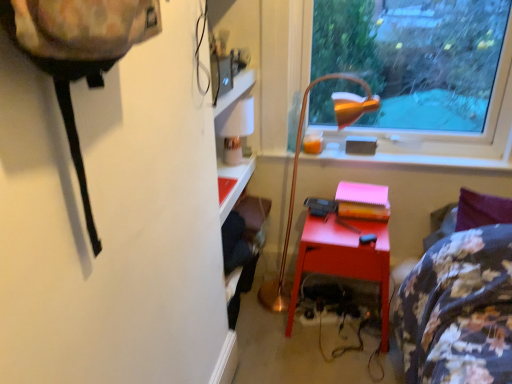
Question: Considering the relative sizes of transparent glass window at upper right and gold metallic floor lamp at center in the image provided, is transparent glass window at upper right wider than gold metallic floor lamp at center?

Choices:
 (A) yes
 (B) no

Answer: (B)

Question: Does transparent glass window at upper right lie in front of gold metallic floor lamp at center?

Choices:
 (A) yes
 (B) no

Answer: (B)

Question: Is transparent glass window at upper right further to the viewer compared to gold metallic floor lamp at center?

Choices:
 (A) yes
 (B) no

Answer: (A)

Question: Is transparent glass window at upper right to the right of gold metallic floor lamp at center from the viewer's perspective?

Choices:
 (A) yes
 (B) no

Answer: (A)

Question: Is transparent glass window at upper right placed right next to gold metallic floor lamp at center?

Choices:
 (A) yes
 (B) no

Answer: (B)

Question: Is point (340, 254) positioned closer to the camera than point (450, 157)?

Choices:
 (A) farther
 (B) closer

Answer: (B)

Question: In terms of size, does matte red desk at center appear bigger or smaller than matte orange lampshade at upper center?

Choices:
 (A) small
 (B) big

Answer: (B)

Question: Is matte red desk at center in front of or behind matte orange lampshade at upper center in the image?

Choices:
 (A) behind
 (B) front

Answer: (B)

Question: Choose the correct answer: Is matte red desk at center inside matte orange lampshade at upper center or outside it?

Choices:
 (A) outside
 (B) inside

Answer: (A)

Question: From the image's perspective, is transparent glass window at upper right above or below gold metallic floor lamp at center?

Choices:
 (A) above
 (B) below

Answer: (A)

Question: Is transparent glass window at upper right bigger or smaller than gold metallic floor lamp at center?

Choices:
 (A) small
 (B) big

Answer: (A)

Question: From a real-world perspective, relative to gold metallic floor lamp at center, is transparent glass window at upper right vertically above or below?

Choices:
 (A) above
 (B) below

Answer: (A)

Question: Do you think transparent glass window at upper right is within gold metallic floor lamp at center, or outside of it?

Choices:
 (A) outside
 (B) inside

Answer: (A)

Question: Is gold metallic floor lamp at center wider or thinner than transparent glass window at upper right?

Choices:
 (A) wide
 (B) thin

Answer: (A)

Question: In terms of height, does gold metallic floor lamp at center look taller or shorter compared to transparent glass window at upper right?

Choices:
 (A) tall
 (B) short

Answer: (A)